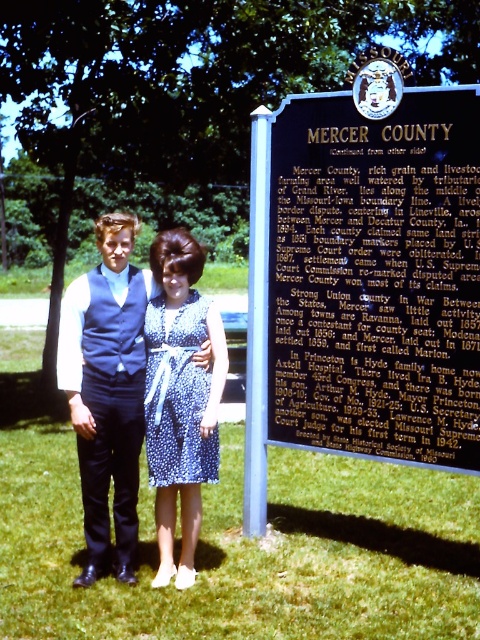
Question: Is black metal sign at upper center further to camera compared to blue dotted dress at center?

Choices:
 (A) yes
 (B) no

Answer: (B)

Question: Can you confirm if black metal sign at upper center is wider than matte blue dress at center?

Choices:
 (A) yes
 (B) no

Answer: (A)

Question: Can you confirm if black metal sign at upper center is positioned to the left of blue dotted fabric dress at center?

Choices:
 (A) yes
 (B) no

Answer: (B)

Question: Which of the following is the closest to the observer?

Choices:
 (A) (273, 225)
 (B) (223, 344)

Answer: (B)

Question: Which point is closer to the camera?

Choices:
 (A) matte blue dress at center
 (B) blue dotted fabric dress at center
 (C) blue dotted dress at center
 (D) black metal sign at upper center

Answer: (D)

Question: Based on their relative distances, which object is nearer to the matte blue dress at center?

Choices:
 (A) black metal sign at upper center
 (B) blue dotted dress at center
 (C) blue dotted fabric dress at center

Answer: (C)